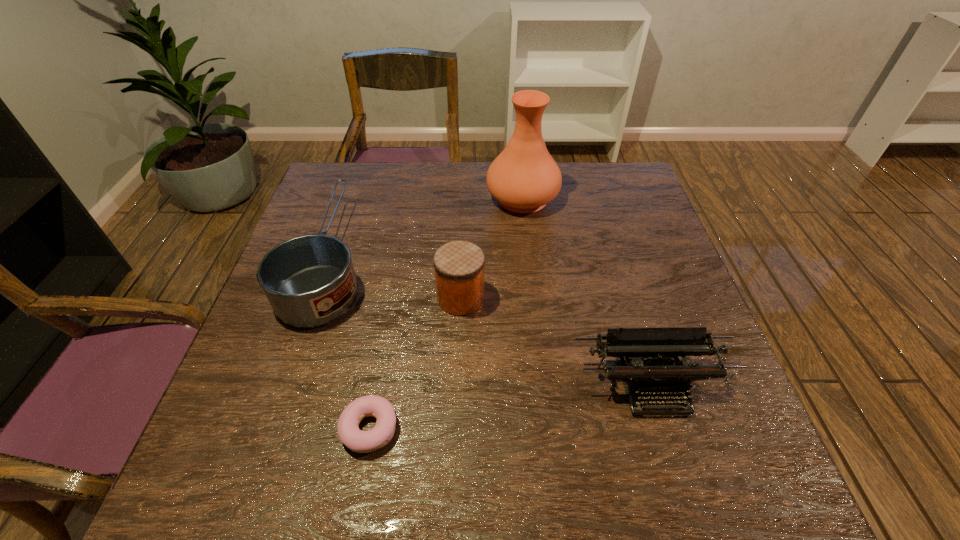
This screenshot has width=960, height=540. I want to click on vase, so pos(524,177).

Where is `jar`? Image resolution: width=960 pixels, height=540 pixels. jar is located at coordinates (459, 266).

The image size is (960, 540). I want to click on the leftmost object, so 309,280.

This screenshot has width=960, height=540. What are the coordinates of `typewriter` in the screenshot? It's located at pos(656,376).

You are a GUI agent. You are given a task and a screenshot of the screen. Output one action in this format:
    pyautogui.click(x=<x>, y=<y>)
    Task: Click on the second object from left to right
    
    Given the screenshot: What is the action you would take?
    pyautogui.click(x=350, y=435)

I want to click on doughnut, so click(350, 435).

Locate an element on the screen. The image size is (960, 540). blank space located on the right of the tallest object is located at coordinates (634, 198).

You are a GUI agent. You are given a task and a screenshot of the screen. Output one action in this format:
    pyautogui.click(x=<x>, y=<y>)
    Task: Click on the free space located 0.120m on the back of the third object from right to left
    Image resolution: width=960 pixels, height=540 pixels.
    Given the screenshot: What is the action you would take?
    pyautogui.click(x=463, y=248)

Identify the location of free region located with the handle extending from one side of the saucepan. The image size is (960, 540). (361, 171).

Where is `blank area located with the handle extending from one side of the saucepan`? Image resolution: width=960 pixels, height=540 pixels. blank area located with the handle extending from one side of the saucepan is located at coordinates (362, 167).